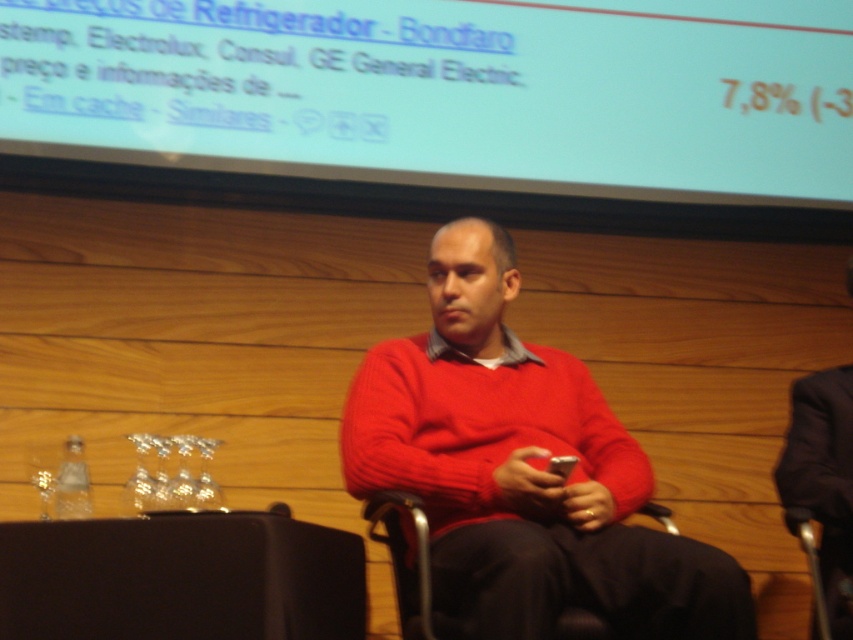
Is point (515, 160) more distant than point (422, 589)?

Yes, it is.

Does white matte projection screen at upper center have a lesser height compared to metallic silver chair at center?

No, white matte projection screen at upper center is not shorter than metallic silver chair at center.

Is point (717, 90) positioned in front of point (566, 627)?

No, (717, 90) is further to viewer.

Locate an element on the screen. Image resolution: width=853 pixels, height=640 pixels. white matte projection screen at upper center is located at coordinates (445, 92).

Identify the location of white matte projection screen at upper center. (445, 92).

Can you confirm if white matte projection screen at upper center is wider than knitted red sweater at center?

Yes, white matte projection screen at upper center is wider than knitted red sweater at center.

Is point (698, 125) more distant than point (445, 445)?

That is True.

You are a GUI agent. You are given a task and a screenshot of the screen. Output one action in this format:
    pyautogui.click(x=<x>, y=<y>)
    Task: Click on the white matte projection screen at upper center
    Image resolution: width=853 pixels, height=640 pixels.
    Given the screenshot: What is the action you would take?
    pyautogui.click(x=445, y=92)

Does knitted red sweater at center appear over metallic silver chair at center?

Indeed, knitted red sweater at center is positioned over metallic silver chair at center.

Is knitted red sweater at center shorter than metallic silver chair at center?

No, knitted red sweater at center is not shorter than metallic silver chair at center.

Which is behind, point (451, 433) or point (404, 577)?

The point (451, 433) is behind.

Identify the location of knitted red sweater at center. Image resolution: width=853 pixels, height=640 pixels. (521, 470).